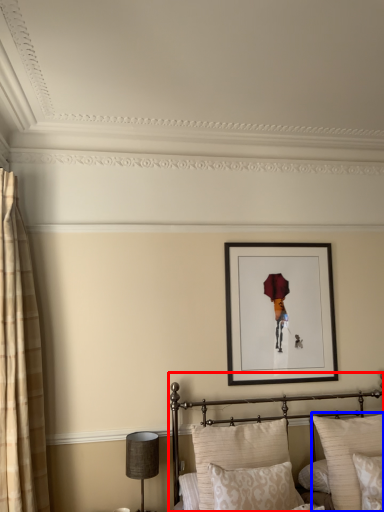
Question: Among these objects, which one is farthest to the camera, bed (highlighted by a red box) or pillow (highlighted by a blue box)?

Choices:
 (A) bed
 (B) pillow

Answer: (B)